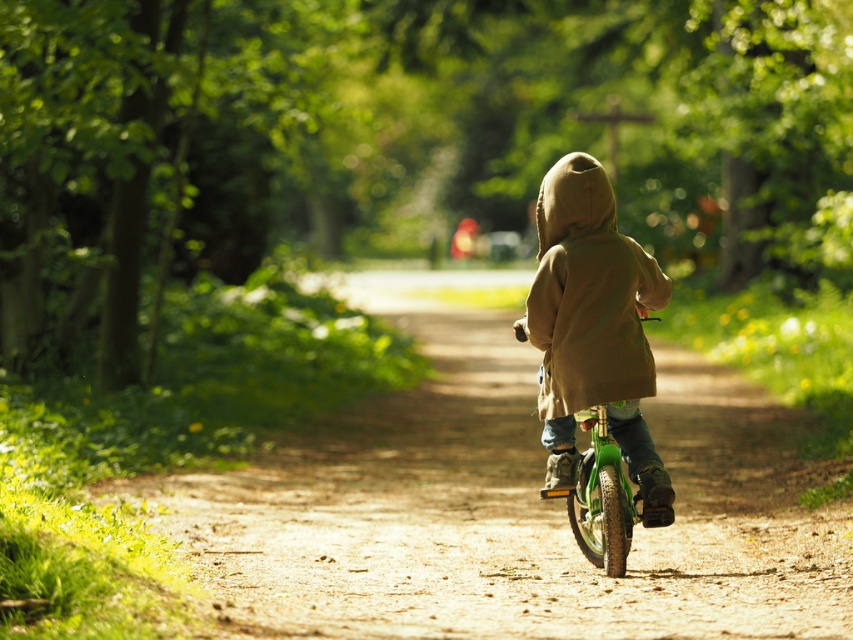
You are a photographer trying to capture the child in the scene. Since the camouflage fabric jacket at center and the green matte bicycle at center are both at the center, which one should you focus on to ensure the child is in the frame?

The camouflage fabric jacket at center has a larger size compared to the green matte bicycle at center, so focusing on the camouflage fabric jacket at center will ensure the child is in the frame as it is bigger and more prominent.

You are a photographer trying to capture the child and the bicycle in a single shot. Given that your camera frame can only accommodate objects up to the width of the green matte bicycle at center, will the camouflage fabric jacket at center of the child fit within the frame?

The camouflage fabric jacket at center is wider than the green matte bicycle at center. Since the camera frame can only accommodate the width of the green matte bicycle at center, the camouflage fabric jacket at center will not fit within the frame.

You are a photographer capturing the scene of a child riding a bicycle. You notice the camouflage fabric jacket at center and the green matte bicycle at center. Which object is covering part of the other?

The camouflage fabric jacket at center is positioned over the green matte bicycle at center, so the jacket is covering part of the bicycle.